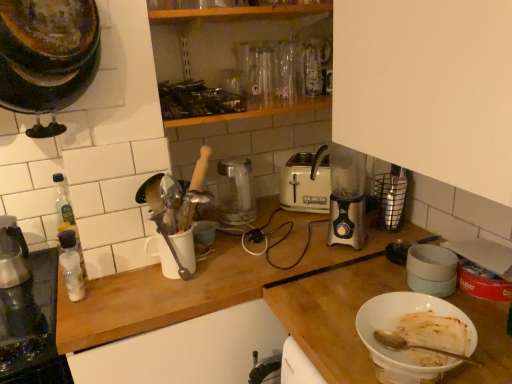
The width and height of the screenshot is (512, 384). In order to click on unoccupied area in front of matte white cup at center, which is the 1th bowl from back to front in this screenshot , I will do `click(192, 264)`.